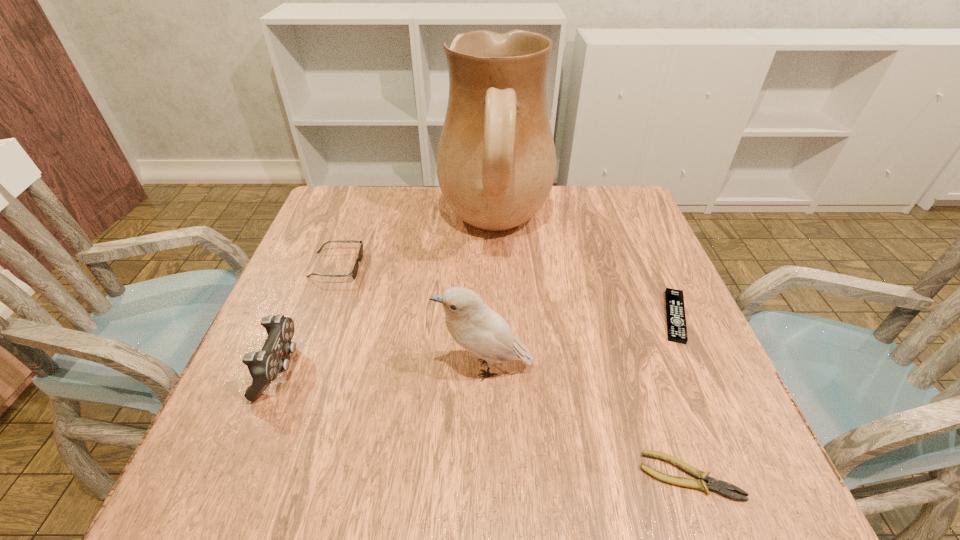
Identify the location of remote control that is at the right edge. (675, 310).

Locate an element on the screen. The height and width of the screenshot is (540, 960). pliers located at the right edge is located at coordinates (712, 484).

Locate an element on the screen. The height and width of the screenshot is (540, 960). object that is at the near right corner is located at coordinates (712, 484).

Identify the location of free space at the far edge of the desktop. This screenshot has width=960, height=540. pyautogui.click(x=548, y=203).

Where is `vacant region at the left edge`? Image resolution: width=960 pixels, height=540 pixels. vacant region at the left edge is located at coordinates (231, 394).

Where is `vacant space at the right edge`? vacant space at the right edge is located at coordinates (612, 260).

The image size is (960, 540). What are the coordinates of `free point at the far left corner` in the screenshot? It's located at (355, 208).

At what (x,y) coordinates should I click in order to perform the action: click on vacant space at the near left corner of the desktop. Please return your answer as a coordinate pair (x, y). Looking at the image, I should click on (267, 451).

The image size is (960, 540). I want to click on vacant point at the far right corner, so click(576, 193).

This screenshot has height=540, width=960. I want to click on free space between the cream pitcher and the remote control, so click(585, 272).